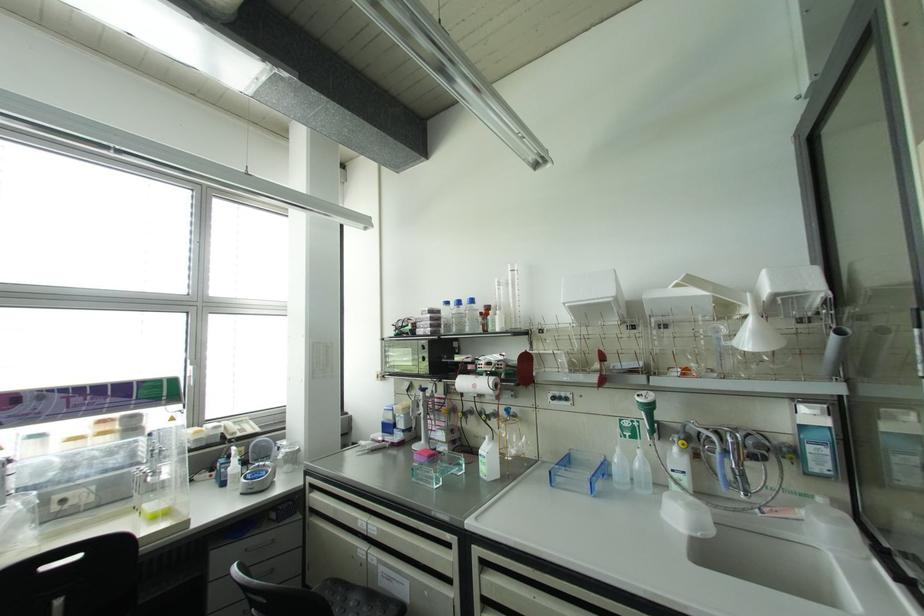
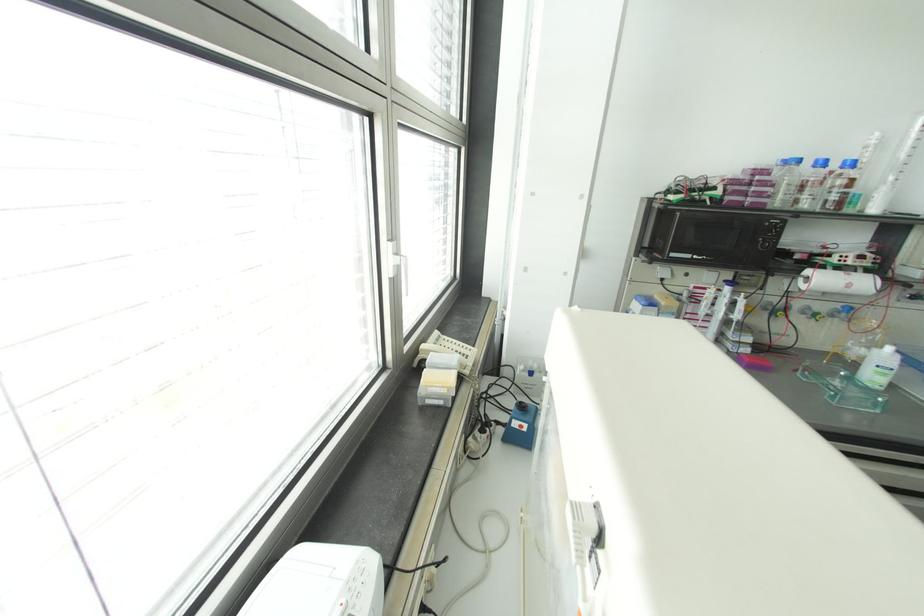
The point at [446,302] is marked in the first image. Where is the corresponding point in the second image?

(797, 160)